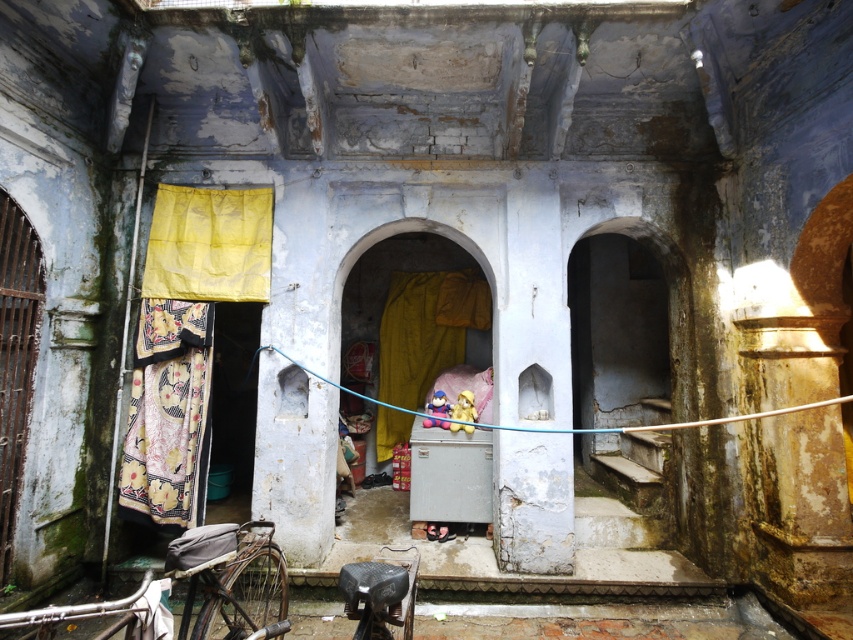
Question: Can you confirm if yellow fabric at center is bigger than metallic silver bicycle at lower left?

Choices:
 (A) yes
 (B) no

Answer: (B)

Question: Considering the relative positions of printed fabric laundry at left and yellow fabric at center in the image provided, where is printed fabric laundry at left located with respect to yellow fabric at center?

Choices:
 (A) left
 (B) right

Answer: (A)

Question: Among these points, which one is nearest to the camera?

Choices:
 (A) (177, 372)
 (B) (70, 618)

Answer: (B)

Question: Which of the following is the farthest from the observer?

Choices:
 (A) metallic silver bicycle at lower left
 (B) printed fabric laundry at left
 (C) yellow fabric at center

Answer: (C)

Question: Can you confirm if printed fabric laundry at left is wider than yellow fabric at center?

Choices:
 (A) yes
 (B) no

Answer: (B)

Question: Among these points, which one is nearest to the camera?

Choices:
 (A) (247, 612)
 (B) (181, 374)

Answer: (A)